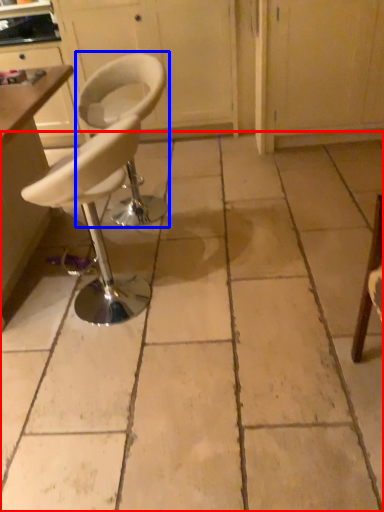
Question: Among these objects, which one is nearest to the camera, concrete (highlighted by a red box) or chair (highlighted by a blue box)?

Choices:
 (A) concrete
 (B) chair

Answer: (A)